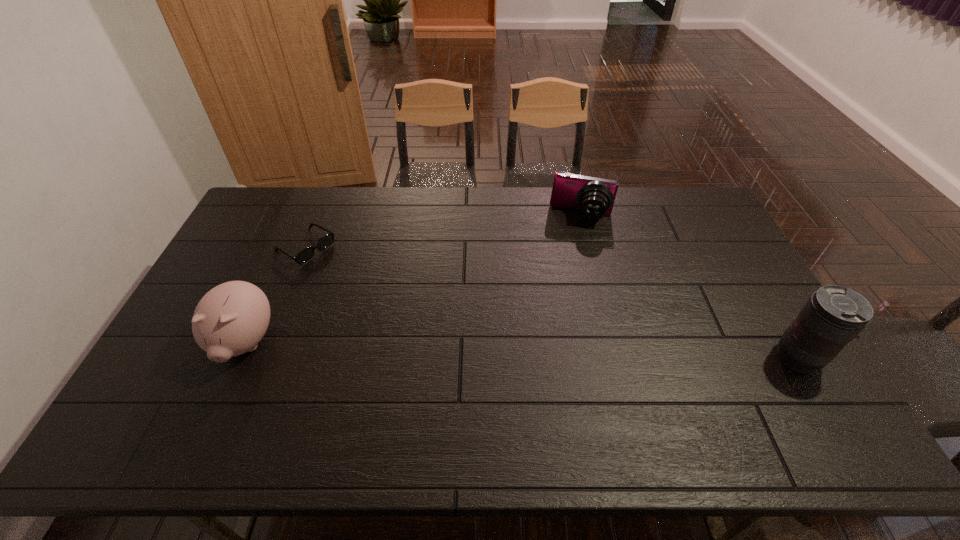
Locate an element on the screen. Image resolution: width=960 pixels, height=540 pixels. object that is the third closest one to the third shortest object is located at coordinates (833, 316).

Identify which object is the nearest to the second tallest object. Please provide its 2D coordinates. Your answer should be formatted as a tuple, i.e. [(x, y)], where the tuple contains the x and y coordinates of a point satisfying the conditions above.

[(306, 254)]

The width and height of the screenshot is (960, 540). Identify the location of vacant region that satisfies the following two spatial constraints: 1. on the front side of the second object from right to left; 2. on the side of the telephoto lens where the control switches are located. (618, 358).

What are the coordinates of `vacant space that satisfies the following two spatial constraints: 1. at the snout of the rightmost object; 2. on the side of the piggy bank where the control switches are located` in the screenshot? It's located at (238, 358).

Identify the location of vacant position in the image that satisfies the following two spatial constraints: 1. on the front side of the sunglasses; 2. on the side of the tallest object where the control switches are located. (260, 358).

I want to click on blank space that satisfies the following two spatial constraints: 1. at the snout of the second tallest object; 2. on the side of the telephoto lens where the control switches are located, so [238, 358].

The width and height of the screenshot is (960, 540). I want to click on free space that satisfies the following two spatial constraints: 1. at the snout of the telephoto lens; 2. on the side of the second tallest object where the control switches are located, so click(x=238, y=358).

I want to click on vacant area in the image that satisfies the following two spatial constraints: 1. at the snout of the tallest object; 2. on the side of the piggy bank where the control switches are located, so click(238, 358).

Identify the location of vacant area in the image that satisfies the following two spatial constraints: 1. at the snout of the piggy bank; 2. on the side of the rightmost object where the control switches are located. This screenshot has height=540, width=960. coord(238,358).